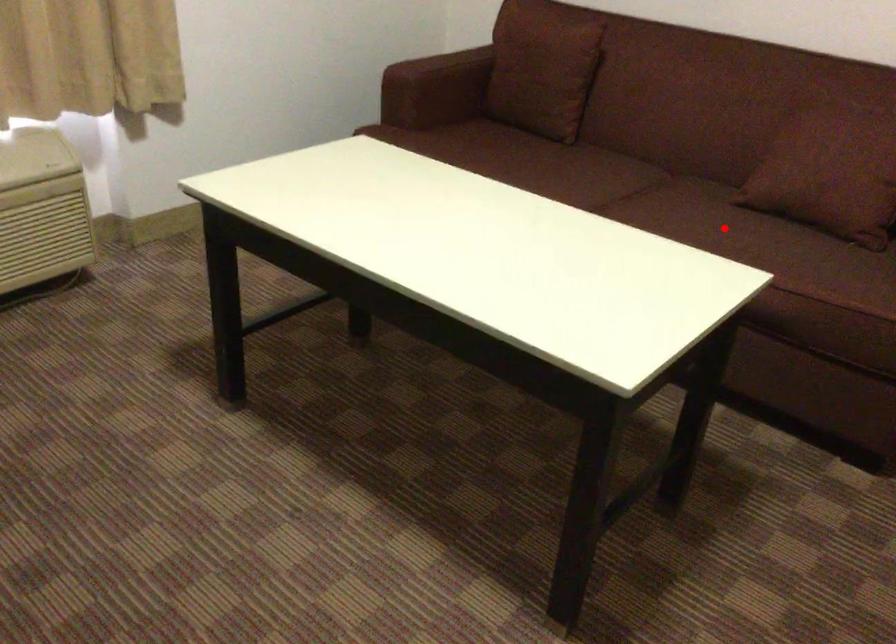
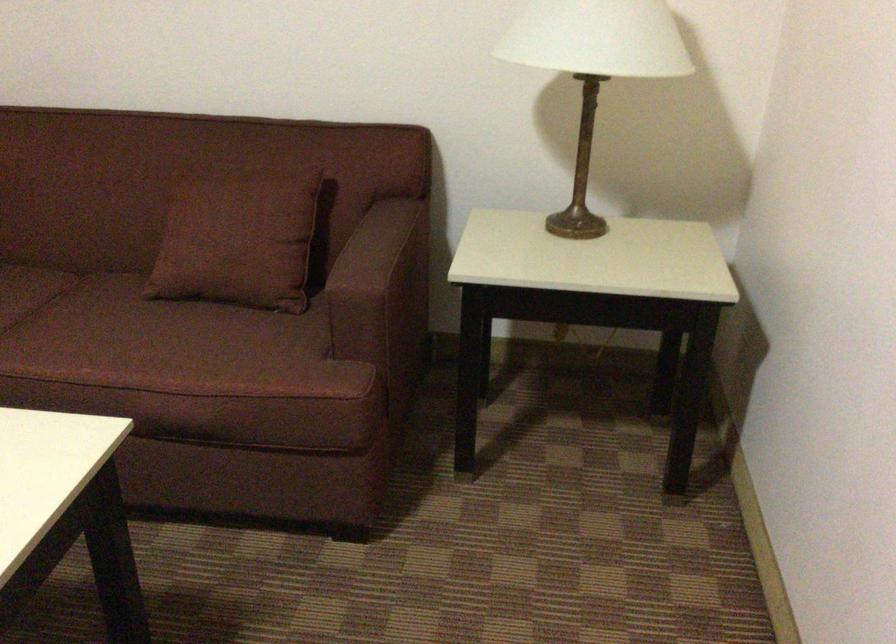
Where in the second image is the point corresponding to the highlighted location from the first image?

(135, 339)